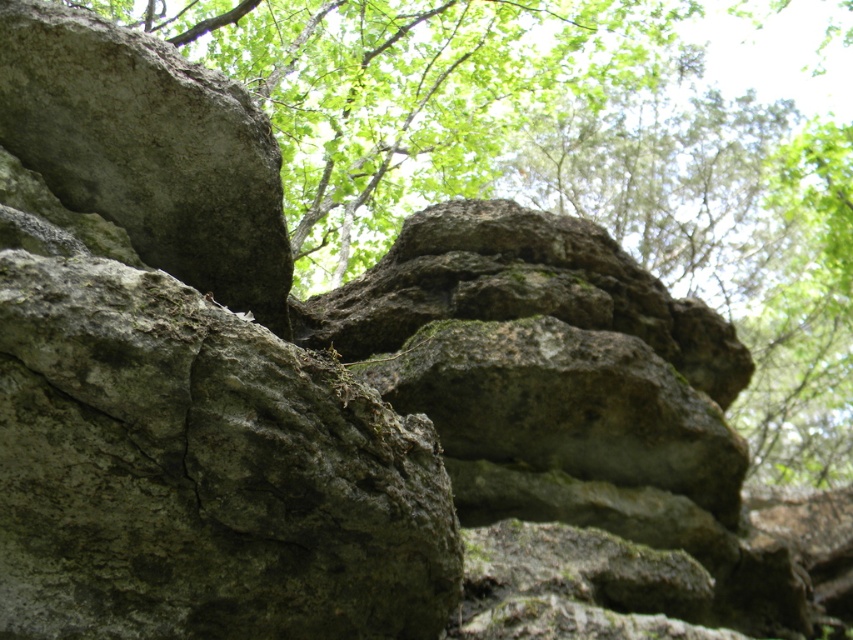
You are a geologist measuring the distance between two rocks in a forest. You have a measuring tape that can extend up to 8 feet. Can you measure the distance between the green mossy rock at upper center and the gray rough rock at upper left without needing to extend the tape beyond its limit?

The distance between the green mossy rock at upper center and the gray rough rock at upper left is 7.99 feet, which is just under the 8 feet limit of the measuring tape. Therefore, you can measure the distance without extending the tape beyond its limit.

You are a geologist examining the rocky formation. You have a measuring tape and need to determine if the green mossy rock at upper center can fit horizontally across the gray rough rock at upper left. Can it fit?

The green mossy rock at upper center might be wider than gray rough rock at upper left, so it may not fit horizontally across the gray rough rock at upper left.

You are a hiker who wants to place a small GPS marker on the closest rock to you between the green mossy rock at upper center and the gray rough rock at upper left. Which rock should you choose?

You should choose the green mossy rock at upper center because it is closer to you than the gray rough rock at upper left.